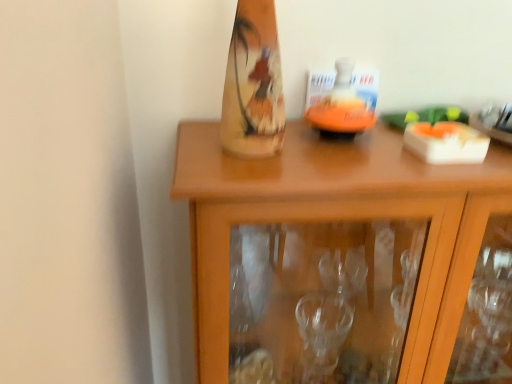
Question: Can you confirm if wooden cabinet at center is bigger than orange matte candle holder at center?

Choices:
 (A) yes
 (B) no

Answer: (A)

Question: From the image's perspective, would you say wooden cabinet at center is shown under orange matte candle holder at center?

Choices:
 (A) no
 (B) yes

Answer: (B)

Question: From a real-world perspective, does wooden cabinet at center stand above orange matte candle holder at center?

Choices:
 (A) yes
 (B) no

Answer: (B)

Question: Considering the relative positions of wooden cabinet at center and orange matte candle holder at center in the image provided, is wooden cabinet at center to the left of orange matte candle holder at center from the viewer's perspective?

Choices:
 (A) yes
 (B) no

Answer: (B)

Question: Does wooden cabinet at center have a smaller size compared to orange matte candle holder at center?

Choices:
 (A) no
 (B) yes

Answer: (A)

Question: Can you confirm if wooden cabinet at center is wider than orange matte candle holder at center?

Choices:
 (A) no
 (B) yes

Answer: (B)

Question: Does orange matte candle holder at center turn towards wooden cabinet at center?

Choices:
 (A) yes
 (B) no

Answer: (B)

Question: Is orange matte candle holder at center facing away from wooden cabinet at center?

Choices:
 (A) no
 (B) yes

Answer: (A)

Question: Is orange matte candle holder at center at the left side of wooden cabinet at center?

Choices:
 (A) no
 (B) yes

Answer: (B)

Question: From a real-world perspective, is orange matte candle holder at center positioned over wooden cabinet at center based on gravity?

Choices:
 (A) yes
 (B) no

Answer: (A)

Question: Considering the relative positions of orange matte candle holder at center and wooden cabinet at center in the image provided, is orange matte candle holder at center behind wooden cabinet at center?

Choices:
 (A) no
 (B) yes

Answer: (B)

Question: From the image's perspective, is orange matte candle holder at center below wooden cabinet at center?

Choices:
 (A) yes
 (B) no

Answer: (B)

Question: Is wooden cabinet at center wider or thinner than orange matte candle holder at center?

Choices:
 (A) wide
 (B) thin

Answer: (A)